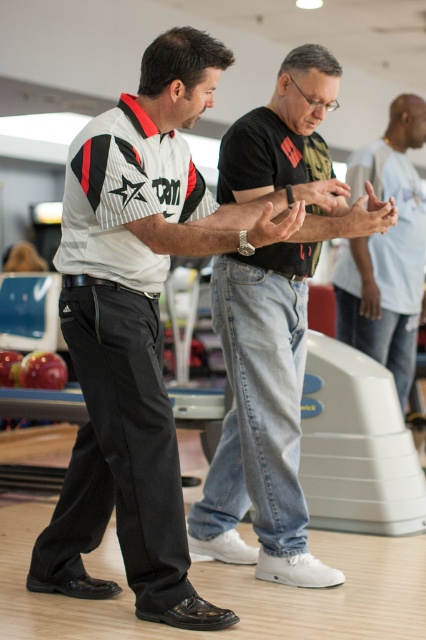
Based on the photo, you are a photographer positioned at the back of the bowling alley. You want to take a photo of the white matte shirt at center and jeans at center. The minimum distance required for your camera to focus on both subjects clearly is 24 inches. Based on the scene description, will the camera be able to focus on both subjects clearly?

The white matte shirt at center and jeans at center are 22.04 inches apart, which is less than the 24 inches required for the camera to focus clearly. Therefore, the camera may not be able to focus on both subjects clearly.